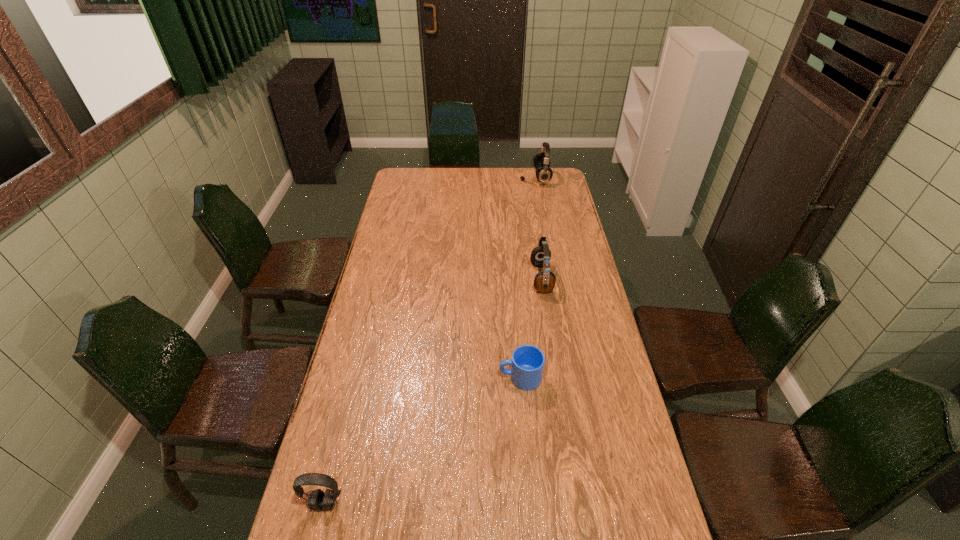
Identify the location of the farthest headset. The height and width of the screenshot is (540, 960). (544, 173).

Where is `the third nearest object`? the third nearest object is located at coordinates (544, 281).

Identify the location of the leftmost object. This screenshot has width=960, height=540. (318, 500).

I want to click on the nearest headset, so click(x=318, y=500).

You are a GUI agent. You are given a task and a screenshot of the screen. Output one action in this format:
    pyautogui.click(x=<x>, y=<y>)
    Task: Click on the shortest object
    Image resolution: width=960 pixels, height=540 pixels.
    Given the screenshot: What is the action you would take?
    pyautogui.click(x=527, y=364)

Identify the location of the third object from right to left. (527, 364).

This screenshot has height=540, width=960. Find the location of `free space located 0.170m with the microphone on the side of the farthest object`. free space located 0.170m with the microphone on the side of the farthest object is located at coordinates (488, 178).

Identify the location of vacant space located with the microphone on the side of the farthest object. This screenshot has height=540, width=960. (476, 178).

In order to click on free region located 0.050m with the microphone on the side of the farthest object in this screenshot , I will do `click(511, 178)`.

Find the location of a particular element. This screenshot has height=540, width=960. free space located on the ear cups of the second farthest headset is located at coordinates pos(449,279).